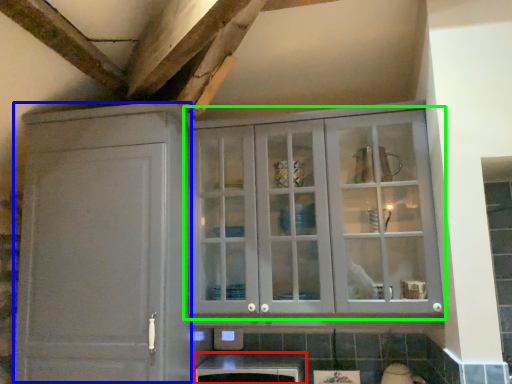
Question: Which is farther away from cabinetry (highlighted by a red box)? cabinetry (highlighted by a blue box) or cupboard (highlighted by a green box)?

Choices:
 (A) cabinetry
 (B) cupboard

Answer: (B)